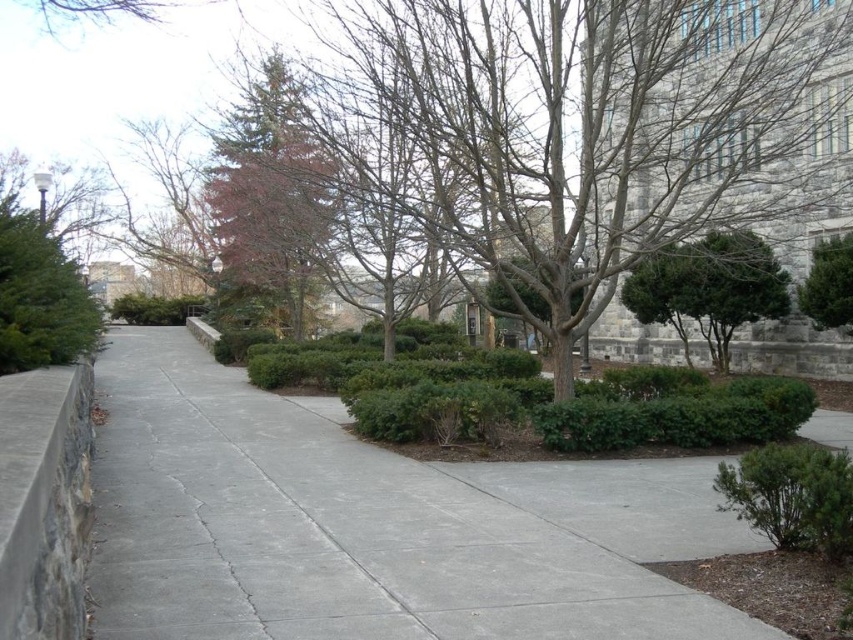
You are standing at the entrance of the large stone building and want to walk to the gray concrete pavement at center. What direction should you walk to reach it?

You should walk towards the center of the image to reach the gray concrete pavement at center.

You are a gardener planning to trim both the green matte tree at upper center and the green matte shrub at lower right. Which one should you start with to follow the standard gardening practice of starting with the closest plants first?

You should start with the green matte shrub at lower right because it is closer to you than the green matte tree at upper center, which is further away.